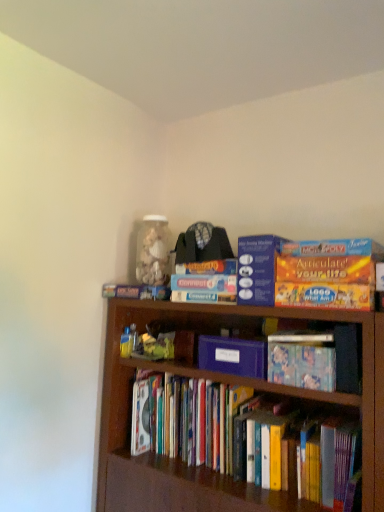
Describe the element at coordinates (250, 437) in the screenshot. This screenshot has width=384, height=512. I see `hardcover books at center, placed as the third book when sorted from top to bottom` at that location.

This screenshot has height=512, width=384. I want to click on hardcover books at center, which ranks as the 1th book in bottom-to-top order, so click(250, 437).

Locate an element on the screen. This screenshot has height=512, width=384. hardcover book at center, which appears as the 2th book when viewed from the top is located at coordinates (302, 360).

Locate an element on the screen. Image resolution: width=384 pixels, height=512 pixels. hardcover books at center, placed as the third book when sorted from top to bottom is located at coordinates (250, 437).

Can you tell me how much purple matte paper at center, which ranks as the second paperback book in top-to-bottom order, and blue cardboard connect 4 game at upper center, which is the 1th book in top-to-bottom order, differ in facing direction?

15.7 degrees separate the facing orientations of purple matte paper at center, which ranks as the second paperback book in top-to-bottom order, and blue cardboard connect 4 game at upper center, which is the 1th book in top-to-bottom order.

Does purple matte paper at center, which ranks as the second paperback book in top-to-bottom order, have a greater width compared to blue cardboard connect 4 game at upper center, which is the 1th book in top-to-bottom order?

Yes.

Does point (237, 338) come behind point (188, 283)?

That is False.

From the image's perspective, which is below, purple matte paper at center, which ranks as the second paperback book in top-to-bottom order, or blue cardboard connect 4 game at upper center, which is the 1th book in top-to-bottom order?

purple matte paper at center, which ranks as the second paperback book in top-to-bottom order, appears lower in the image.

Is blue cardboard connect 4 game at upper center, which is the 1th book in top-to-bottom order, inside orange matte board game at upper center, which appears as the second paperback book when ordered from the bottom?

No, orange matte board game at upper center, which appears as the second paperback book when ordered from the bottom, does not contain blue cardboard connect 4 game at upper center, which is the 1th book in top-to-bottom order.

From a real-world perspective, which object stands above the other?

From a 3D spatial view, orange matte board game at upper center, positioned as the 1th paperback book in top-to-bottom order, is above.

Image resolution: width=384 pixels, height=512 pixels. What are the coordinates of `paperback book that is above the blue cardboard connect 4 game at upper center, arranged as the third book when ordered from the bottom (from a real-world perspective)` in the screenshot? It's located at (257, 269).

From the image's perspective, between orange matte board game at upper center, positioned as the 1th paperback book in top-to-bottom order, and blue cardboard connect 4 game at upper center, arranged as the third book when ordered from the bottom, who is located below?

blue cardboard connect 4 game at upper center, arranged as the third book when ordered from the bottom, is shown below in the image.

Between point (318, 349) and point (221, 281), which one is positioned in front?

The point (318, 349) is closer to the camera.

Locate an element on the screen. The image size is (384, 512). book that is above the hardcover book at center, the 2th book positioned from the bottom (from the image's perspective) is located at coordinates (205, 282).

Does hardcover book at center, the 2th book positioned from the bottom, lie in front of blue cardboard connect 4 game at upper center, which is the 1th book in top-to-bottom order?

Yes, hardcover book at center, the 2th book positioned from the bottom, is in front of blue cardboard connect 4 game at upper center, which is the 1th book in top-to-bottom order.

Could you tell me if hardcover book at center, which appears as the 2th book when viewed from the top, is turned towards blue cardboard connect 4 game at upper center, which is the 1th book in top-to-bottom order?

No, hardcover book at center, which appears as the 2th book when viewed from the top, is not facing towards blue cardboard connect 4 game at upper center, which is the 1th book in top-to-bottom order.

How different are the orientations of purple matte paper at center, which ranks as the second paperback book in top-to-bottom order, and hardcover book at center, which appears as the 2th book when viewed from the top, in degrees?

They differ by 0 degrees in their facing directions.

Who is smaller, purple matte paper at center, which ranks as the second paperback book in top-to-bottom order, or hardcover book at center, the 2th book positioned from the bottom?

Smaller between the two is purple matte paper at center, which ranks as the second paperback book in top-to-bottom order.

Between purple matte paper at center, marked as the 1th paperback book in a bottom-to-top arrangement, and hardcover book at center, which appears as the 2th book when viewed from the top, which one has less height?

purple matte paper at center, marked as the 1th paperback book in a bottom-to-top arrangement.

What are the coordinates of `the 1st paperback book counting from the right of the hardcover books at center, placed as the third book when sorted from top to bottom` in the screenshot? It's located at (233, 356).

Could you tell me if hardcover books at center, which ranks as the 1th book in bottom-to-top order, is facing purple matte paper at center, marked as the 1th paperback book in a bottom-to-top arrangement?

No.

Between hardcover books at center, placed as the third book when sorted from top to bottom, and purple matte paper at center, which ranks as the second paperback book in top-to-bottom order, which one appears on the left side from the viewer's perspective?

hardcover books at center, placed as the third book when sorted from top to bottom, is more to the left.

Between hardcover books at center, placed as the third book when sorted from top to bottom, and purple matte paper at center, marked as the 1th paperback book in a bottom-to-top arrangement, which one has smaller size?

purple matte paper at center, marked as the 1th paperback book in a bottom-to-top arrangement, is smaller.

Is orange matte board game at upper center, which appears as the second paperback book when ordered from the bottom, facing away from hardcover books at center, which ranks as the 1th book in bottom-to-top order?

No, hardcover books at center, which ranks as the 1th book in bottom-to-top order, is not at the back of orange matte board game at upper center, which appears as the second paperback book when ordered from the bottom.

At what (x,y) coordinates should I click in order to perform the action: click on the 1st book to the left of the orange matte board game at upper center, which appears as the second paperback book when ordered from the bottom, counting from the anchor's position. Please return your answer as a coordinate pair (x, y). Looking at the image, I should click on (250, 437).

From the image's perspective, is orange matte board game at upper center, which appears as the second paperback book when ordered from the bottom, above or below hardcover books at center, which ranks as the 1th book in bottom-to-top order?

From the image's perspective, orange matte board game at upper center, which appears as the second paperback book when ordered from the bottom, appears above hardcover books at center, which ranks as the 1th book in bottom-to-top order.

From the picture: In the image, is blue cardboard connect 4 game at upper center, arranged as the third book when ordered from the bottom, on the left side or the right side of hardcover book at center, which appears as the 2th book when viewed from the top?

blue cardboard connect 4 game at upper center, arranged as the third book when ordered from the bottom, is to the left of hardcover book at center, which appears as the 2th book when viewed from the top.

Is blue cardboard connect 4 game at upper center, which is the 1th book in top-to-bottom order, turned away from hardcover book at center, the 2th book positioned from the bottom?

No, hardcover book at center, the 2th book positioned from the bottom, is not at the back of blue cardboard connect 4 game at upper center, which is the 1th book in top-to-bottom order.

In terms of size, does blue cardboard connect 4 game at upper center, arranged as the third book when ordered from the bottom, appear bigger or smaller than hardcover book at center, which appears as the 2th book when viewed from the top?

Considering their sizes, blue cardboard connect 4 game at upper center, arranged as the third book when ordered from the bottom, takes up more space than hardcover book at center, which appears as the 2th book when viewed from the top.

From a real-world perspective, between blue cardboard connect 4 game at upper center, which is the 1th book in top-to-bottom order, and hardcover book at center, the 2th book positioned from the bottom, who is vertically higher?

blue cardboard connect 4 game at upper center, which is the 1th book in top-to-bottom order.

This screenshot has width=384, height=512. In order to click on book that is the 2nd one when counting leftward from the purple matte paper at center, marked as the 1th paperback book in a bottom-to-top arrangement in this screenshot , I will do tap(205, 282).

From the image's perspective, starting from the orange matte board game at upper center, positioned as the 1th paperback book in top-to-bottom order, which book is the 1st one below? Please provide its 2D coordinates.

[(205, 282)]

Considering their positions, is hardcover book at center, the 2th book positioned from the bottom, positioned closer to blue cardboard connect 4 game at upper center, which is the 1th book in top-to-bottom order, than hardcover books at center, which ranks as the 1th book in bottom-to-top order?

Based on the image, hardcover book at center, the 2th book positioned from the bottom, appears to be nearer to blue cardboard connect 4 game at upper center, which is the 1th book in top-to-bottom order.

Considering their positions, is blue cardboard connect 4 game at upper center, which is the 1th book in top-to-bottom order, positioned further to orange matte board game at upper center, positioned as the 1th paperback book in top-to-bottom order, than hardcover book at center, which appears as the 2th book when viewed from the top?

hardcover book at center, which appears as the 2th book when viewed from the top, is positioned further to the anchor orange matte board game at upper center, positioned as the 1th paperback book in top-to-bottom order.

Looking at the image, which one is located further to hardcover book at center, which appears as the 2th book when viewed from the top, purple matte paper at center, which ranks as the second paperback book in top-to-bottom order, or hardcover books at center, placed as the third book when sorted from top to bottom?

Among the two, hardcover books at center, placed as the third book when sorted from top to bottom, is located further to hardcover book at center, which appears as the 2th book when viewed from the top.

Considering their positions, is orange matte board game at upper center, which appears as the second paperback book when ordered from the bottom, positioned further to hardcover books at center, which ranks as the 1th book in bottom-to-top order, than purple matte paper at center, marked as the 1th paperback book in a bottom-to-top arrangement?

orange matte board game at upper center, which appears as the second paperback book when ordered from the bottom, lies further to hardcover books at center, which ranks as the 1th book in bottom-to-top order, than the other object.

Estimate the real-world distances between objects in this image. Which object is closer to hardcover books at center, which ranks as the 1th book in bottom-to-top order, purple matte paper at center, which ranks as the second paperback book in top-to-bottom order, or orange matte board game at upper center, which appears as the second paperback book when ordered from the bottom?

purple matte paper at center, which ranks as the second paperback book in top-to-bottom order.

Estimate the real-world distances between objects in this image. Which object is closer to blue cardboard connect 4 game at upper center, which is the 1th book in top-to-bottom order, hardcover book at center, the 2th book positioned from the bottom, or purple matte paper at center, which ranks as the second paperback book in top-to-bottom order?

purple matte paper at center, which ranks as the second paperback book in top-to-bottom order, lies closer to blue cardboard connect 4 game at upper center, which is the 1th book in top-to-bottom order, than the other object.

Estimate the real-world distances between objects in this image. Which object is further from hardcover books at center, placed as the third book when sorted from top to bottom, orange matte board game at upper center, which appears as the second paperback book when ordered from the bottom, or hardcover book at center, which appears as the 2th book when viewed from the top?

orange matte board game at upper center, which appears as the second paperback book when ordered from the bottom, is positioned further to the anchor hardcover books at center, placed as the third book when sorted from top to bottom.

Estimate the real-world distances between objects in this image. Which object is further from blue cardboard connect 4 game at upper center, which is the 1th book in top-to-bottom order, hardcover books at center, which ranks as the 1th book in bottom-to-top order, or hardcover book at center, the 2th book positioned from the bottom?

hardcover books at center, which ranks as the 1th book in bottom-to-top order, is positioned further to the anchor blue cardboard connect 4 game at upper center, which is the 1th book in top-to-bottom order.

This screenshot has height=512, width=384. In order to click on book between blue cardboard connect 4 game at upper center, arranged as the third book when ordered from the bottom, and hardcover books at center, placed as the third book when sorted from top to bottom, from top to bottom in this screenshot , I will do `click(302, 360)`.

You are a GUI agent. You are given a task and a screenshot of the screen. Output one action in this format:
    pyautogui.click(x=<x>, y=<y>)
    Task: Click on the paperback book between hardcover book at center, which appears as the 2th book when viewed from the top, and hardcover books at center, which ranks as the 1th book in bottom-to-top order, vertically
    This screenshot has width=384, height=512.
    Given the screenshot: What is the action you would take?
    pyautogui.click(x=233, y=356)

You are a GUI agent. You are given a task and a screenshot of the screen. Output one action in this format:
    pyautogui.click(x=<x>, y=<y>)
    Task: Click on the paperback book between orange matte board game at upper center, positioned as the 1th paperback book in top-to-bottom order, and hardcover books at center, placed as the third book when sorted from top to bottom, in the vertical direction
    
    Given the screenshot: What is the action you would take?
    pyautogui.click(x=233, y=356)

Where is `paperback book between blue cardboard connect 4 game at upper center, which is the 1th book in top-to-bottom order, and hardcover books at center, placed as the third book when sorted from top to bottom, in the up-down direction`? This screenshot has width=384, height=512. paperback book between blue cardboard connect 4 game at upper center, which is the 1th book in top-to-bottom order, and hardcover books at center, placed as the third book when sorted from top to bottom, in the up-down direction is located at coordinates (233, 356).